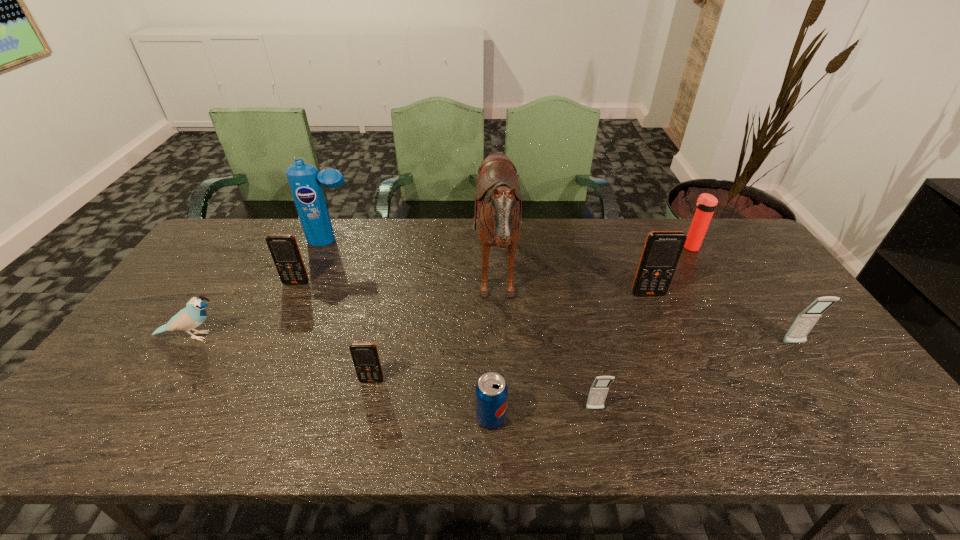
The width and height of the screenshot is (960, 540). In order to click on the closest object to the smallest orange cellular telephone in this screenshot , I will do `click(491, 392)`.

You are a GUI agent. You are given a task and a screenshot of the screen. Output one action in this format:
    pyautogui.click(x=<x>, y=<y>)
    Task: Click on the cellular telephone that is the fourth closest one to the shampoo
    This screenshot has width=960, height=540.
    Given the screenshot: What is the action you would take?
    pyautogui.click(x=599, y=389)

Image resolution: width=960 pixels, height=540 pixels. I want to click on cellular telephone that is the third closest to the leftmost cellular telephone, so click(662, 250).

This screenshot has width=960, height=540. In order to click on orange cellular telephone object that ranks as the second closest to the pop soda in this screenshot , I will do 662,250.

Identify the location of orange cellular telephone object that ranks as the second closest to the eighth farthest object. (662, 250).